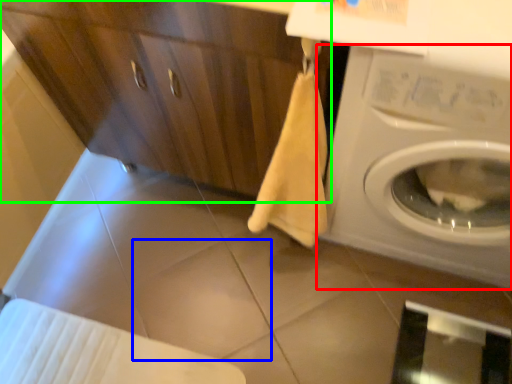
Question: Estimate the real-world distances between objects in this image. Which object is closer to washing machine (highlighted by a red box), tile (highlighted by a blue box) or dresser (highlighted by a green box)?

Choices:
 (A) tile
 (B) dresser

Answer: (B)